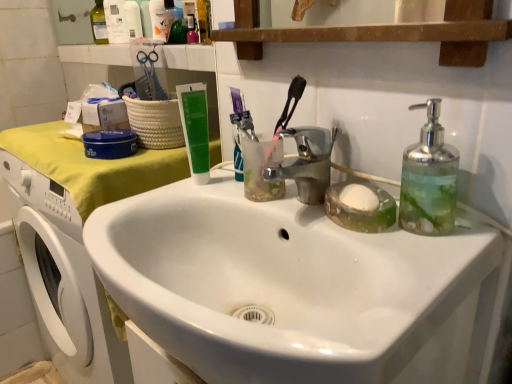
Question: Is green matte tube at upper center taller or shorter than white glossy sink at center?

Choices:
 (A) short
 (B) tall

Answer: (B)

Question: From a real-world perspective, is green matte tube at upper center physically located above or below white glossy sink at center?

Choices:
 (A) above
 (B) below

Answer: (A)

Question: Estimate the real-world distances between objects in this image. Which object is farther from the translucent plastic bottle at upper left, which appears as the third toiletry when viewed from the front?

Choices:
 (A) clear glass soap dispenser at right
 (B) white plastic bottle at upper left, acting as the 2th toiletry starting from the front
 (C) chrome metallic faucet at center
 (D) white glossy sink at center
 (E) green matte tube at upper center

Answer: (A)

Question: Which of these objects is positioned farthest from the translucent plastic bottle at upper left, the first toiletry positioned from the back?

Choices:
 (A) white plastic bottle at upper left, the second toiletry in the right-to-left sequence
 (B) translucent plastic bottle at upper center, the 3th toiletry when ordered from back to front
 (C) white glossy sink at center
 (D) clear glass soap dispenser at right
 (E) green matte tube at upper center

Answer: (D)